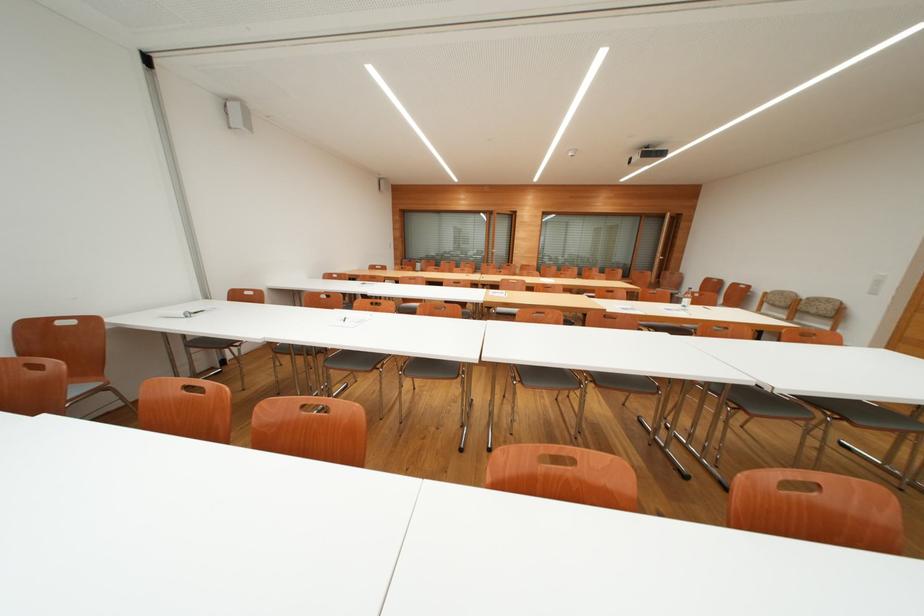
Which object does [686,298] point to?

It corresponds to the plastic water bottle in the image.